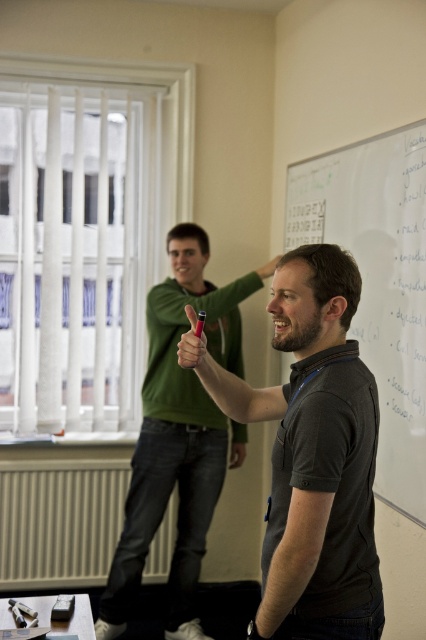
Question: Which object is the closest to the dark gray shirt at center?

Choices:
 (A) green matte hoodie at upper left
 (B) white matte/scratchy whiteboard at upper center

Answer: (B)

Question: Which of these objects is positioned farthest from the green matte hoodie at upper left?

Choices:
 (A) white matte/scratchy whiteboard at upper center
 (B) dark gray shirt at center

Answer: (B)

Question: Is dark gray shirt at center smaller than green matte hoodie at upper left?

Choices:
 (A) yes
 (B) no

Answer: (A)

Question: Is dark gray shirt at center thinner than white matte/scratchy whiteboard at upper center?

Choices:
 (A) no
 (B) yes

Answer: (A)

Question: Does dark gray shirt at center appear over green matte hoodie at upper left?

Choices:
 (A) yes
 (B) no

Answer: (A)

Question: Which point is farther to the camera?

Choices:
 (A) (284, 276)
 (B) (216, 428)
 (C) (371, 312)

Answer: (B)